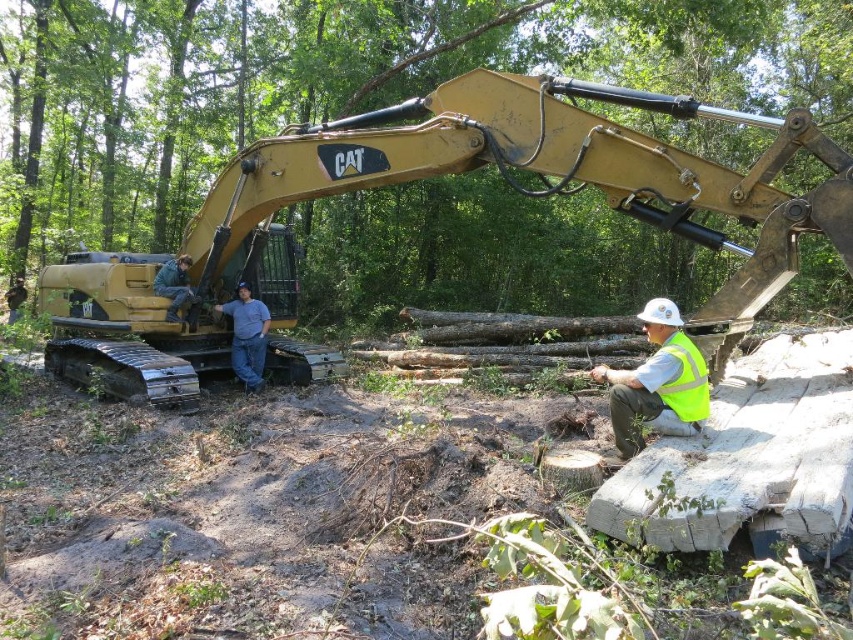
You are a safety inspector at the construction site. You need to ensure that the safety gear is appropriately sized for the workers. Given the gold metallic excavator at left and the brushed metal helmet at left, which object is more suitable for protecting a worker from falling debris?

The brushed metal helmet at left is more suitable for protecting a worker from falling debris since it is a safety gear designed for that purpose, while the gold metallic excavator at left is a large machine and not meant for personal protection.

You are standing at the camera position and want to throw a tool to the person closest to you. Which point should you aim for, point (633, 204) or point (171, 260)?

Point (633, 204) is closer to the camera than point (171, 260), so you should aim for point (633, 204) to reach the person closest to you.